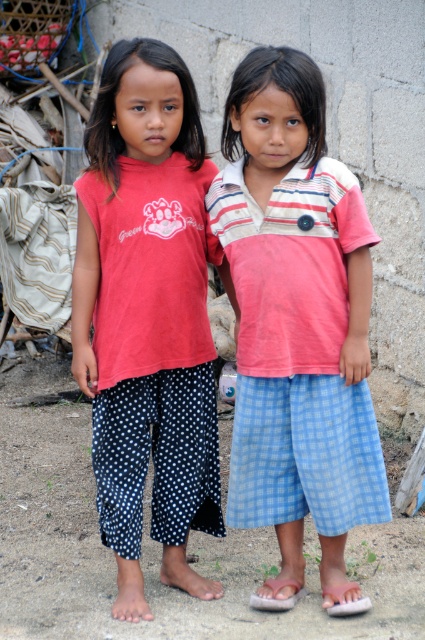
You are a photographer setting up a shoot and need to arrange a matte red shirt at left and a white rubber sandal at lower right in the frame. According to the image, which object should be placed to the left of the other?

The matte red shirt at left is positioned on the left side of white rubber sandal at lower right, so the matte red shirt at left should be placed to the left of the white rubber sandal at lower right.

Where is the striped cotton shirt at center located in the image?

The striped cotton shirt at center is located at point [297,316] in the image.

Consider the image. You are a parent trying to choose between the white rubber sandal at lower right and the brown leather sandal at lower center for your child. Based on their sizes, which sandal would you consider narrower?

The white rubber sandal at lower right is narrower since its width is less than the brown leather sandal at lower center.